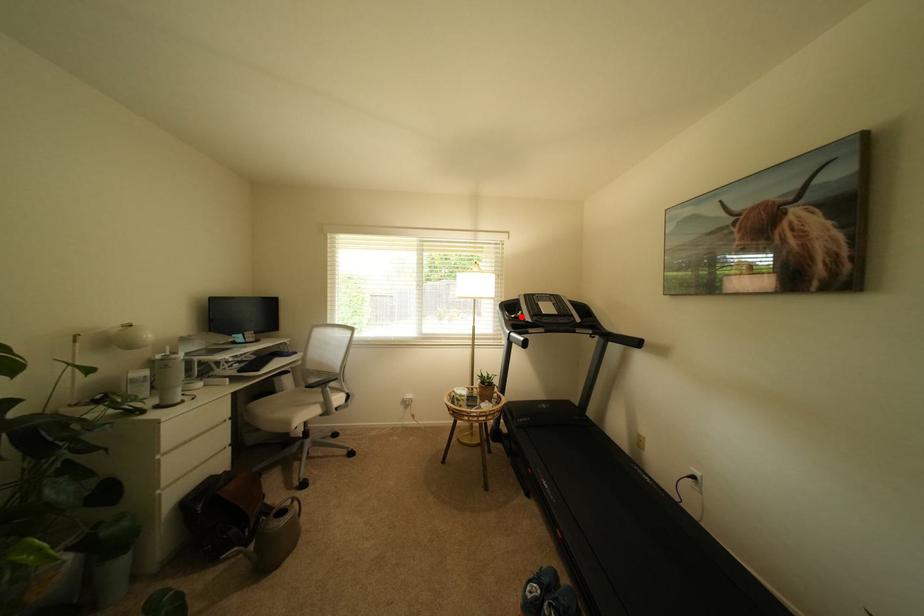
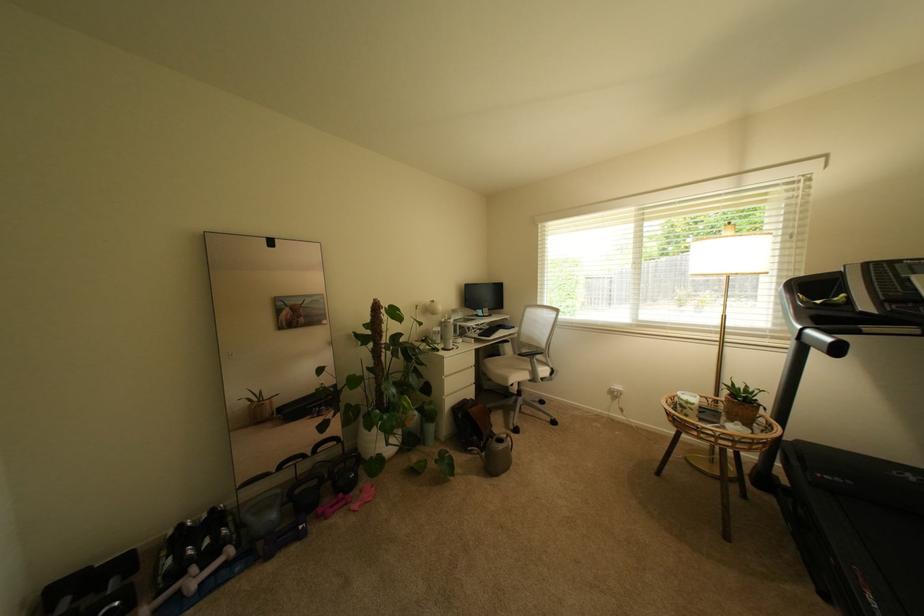
The point at the highlighted location is marked in the first image. Where is the corresponding point in the second image?

(827, 302)